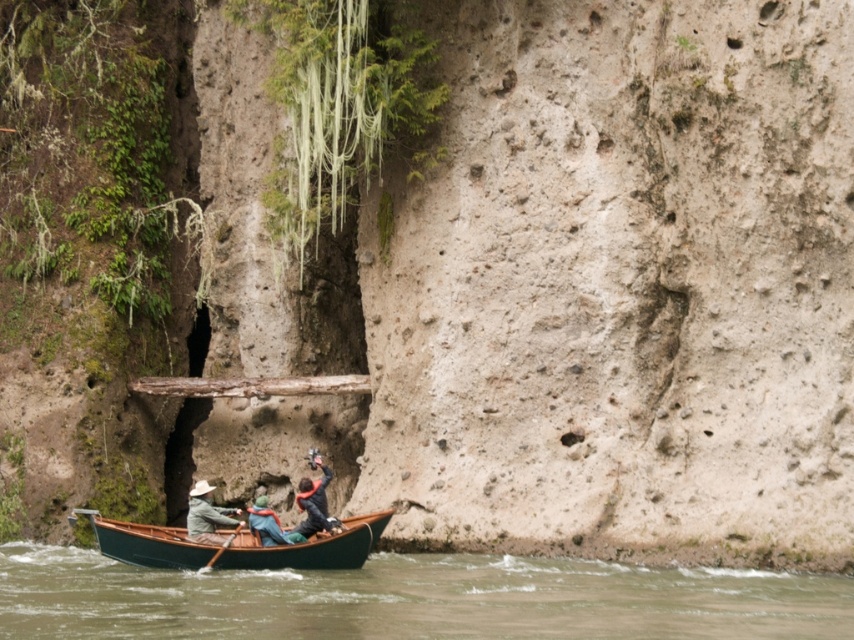
You are standing at the camera position and want to take a photo of the green polished wood canoe at lower center. If your camera has a maximum zoom range of 30 meters, will you be able to capture the canoe clearly without moving closer?

The green polished wood canoe at lower center and camera are 35.83 meters apart, which exceeds the camera maximum zoom range of 30 meters. Therefore, you won not be able to capture the canoe clearly without moving closer.

You are planning to take a trip on the green polished wood boat at lower center and need to bring along your light brown leather jacket at lower left. Considering the boat size, will there be enough space to store your jacket comfortably?

The green polished wood boat at lower center is larger than the light brown leather jacket at lower left, so there should be sufficient space to store the jacket comfortably.